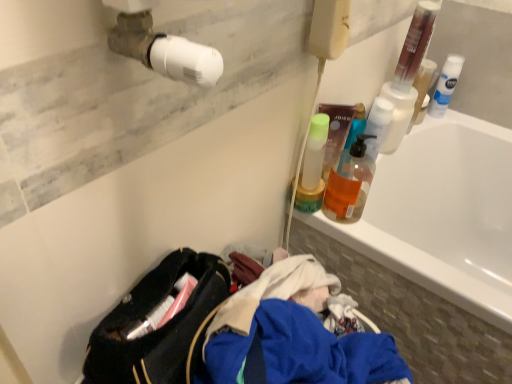
Question: Does white glossy bathtub at upper right have a greater height compared to translucent plastic pump bottle at upper right, the 1th cleaning product positioned from the left?

Choices:
 (A) no
 (B) yes

Answer: (B)

Question: Is white glossy bathtub at upper right oriented away from translucent plastic pump bottle at upper right, acting as the 2th cleaning product starting from the back?

Choices:
 (A) no
 (B) yes

Answer: (A)

Question: Is white glossy bathtub at upper right shorter than translucent plastic pump bottle at upper right, the 1th cleaning product positioned from the left?

Choices:
 (A) yes
 (B) no

Answer: (B)

Question: Does white glossy bathtub at upper right appear on the left side of translucent plastic pump bottle at upper right, acting as the second cleaning product starting from the top?

Choices:
 (A) yes
 (B) no

Answer: (B)

Question: Can translucent plastic pump bottle at upper right, the first cleaning product positioned from the front, be found inside white glossy bathtub at upper right?

Choices:
 (A) no
 (B) yes

Answer: (A)

Question: Does point (352, 127) appear closer or farther from the camera than point (439, 94)?

Choices:
 (A) farther
 (B) closer

Answer: (B)

Question: Looking at the image, does translucent plastic pump bottle at upper right, acting as the second cleaning product starting from the top, seem bigger or smaller compared to white matte shaving cream can at upper right, which ranks as the 1th cleaning product in back-to-front order?

Choices:
 (A) small
 (B) big

Answer: (A)

Question: Is translucent plastic pump bottle at upper right, acting as the 2th cleaning product starting from the back, taller or shorter than white matte shaving cream can at upper right, which is the second cleaning product from bottom to top?

Choices:
 (A) short
 (B) tall

Answer: (A)

Question: From the image's perspective, is translucent plastic pump bottle at upper right, the 1th cleaning product positioned from the left, located above or below white matte shaving cream can at upper right, which ranks as the 1th cleaning product in back-to-front order?

Choices:
 (A) below
 (B) above

Answer: (A)

Question: From a real-world perspective, is white glossy bathtub at upper right physically located above or below translucent plastic pump bottle at upper right, acting as the 2th cleaning product starting from the back?

Choices:
 (A) above
 (B) below

Answer: (B)

Question: Is white glossy bathtub at upper right situated inside translucent plastic pump bottle at upper right, acting as the second cleaning product starting from the top, or outside?

Choices:
 (A) outside
 (B) inside

Answer: (A)

Question: Considering the positions of white glossy bathtub at upper right and translucent plastic pump bottle at upper right, the first cleaning product positioned from the front, in the image, is white glossy bathtub at upper right wider or thinner than translucent plastic pump bottle at upper right, the first cleaning product positioned from the front,?

Choices:
 (A) wide
 (B) thin

Answer: (A)

Question: Considering the positions of white glossy bathtub at upper right and translucent plastic pump bottle at upper right, the 1th cleaning product positioned from the left, in the image, is white glossy bathtub at upper right bigger or smaller than translucent plastic pump bottle at upper right, the 1th cleaning product positioned from the left,?

Choices:
 (A) small
 (B) big

Answer: (B)

Question: Looking at the image, does translucent orange liquid at upper right seem bigger or smaller compared to white matte shaving cream can at upper right, which ranks as the 1th cleaning product in back-to-front order?

Choices:
 (A) big
 (B) small

Answer: (A)

Question: Considering the positions of point (345, 211) and point (437, 87), is point (345, 211) closer or farther from the camera than point (437, 87)?

Choices:
 (A) closer
 (B) farther

Answer: (A)